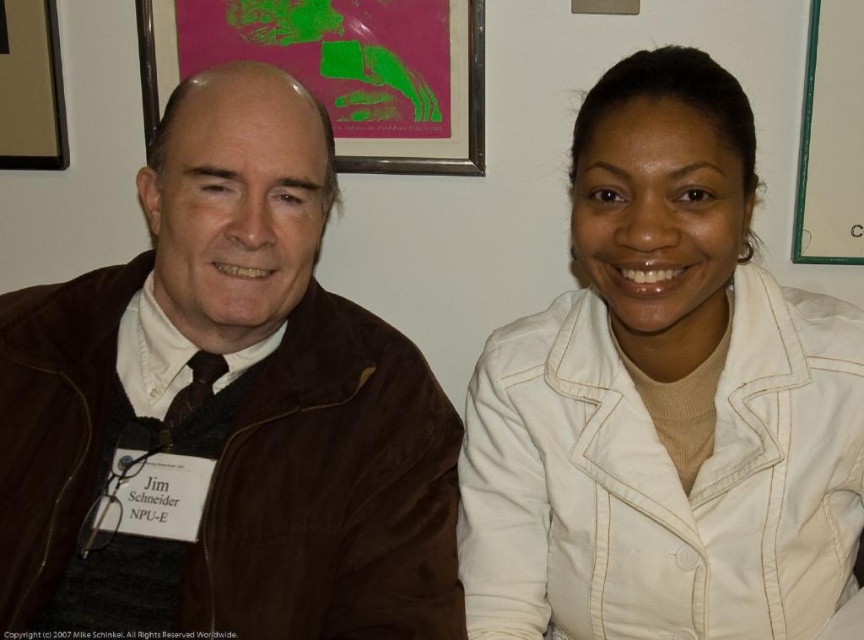
Question: Can you confirm if brown suede jacket at left is positioned to the right of pink paper at upper center?

Choices:
 (A) no
 (B) yes

Answer: (A)

Question: Which object appears closest to the camera in this image?

Choices:
 (A) white matte jacket at upper right
 (B) brown suede jacket at left
 (C) pink paper at upper center

Answer: (A)

Question: Which point appears farthest from the camera in this image?

Choices:
 (A) (324, 612)
 (B) (401, 81)

Answer: (B)

Question: Which of the following is the farthest from the observer?

Choices:
 (A) brown suede jacket at left
 (B) white matte jacket at upper right
 (C) pink paper at upper center

Answer: (C)

Question: Is pink paper at upper center smaller than brown wooden picture frame at upper left?

Choices:
 (A) yes
 (B) no

Answer: (B)

Question: Is white matte jacket at upper right above pink paper at upper center?

Choices:
 (A) no
 (B) yes

Answer: (A)